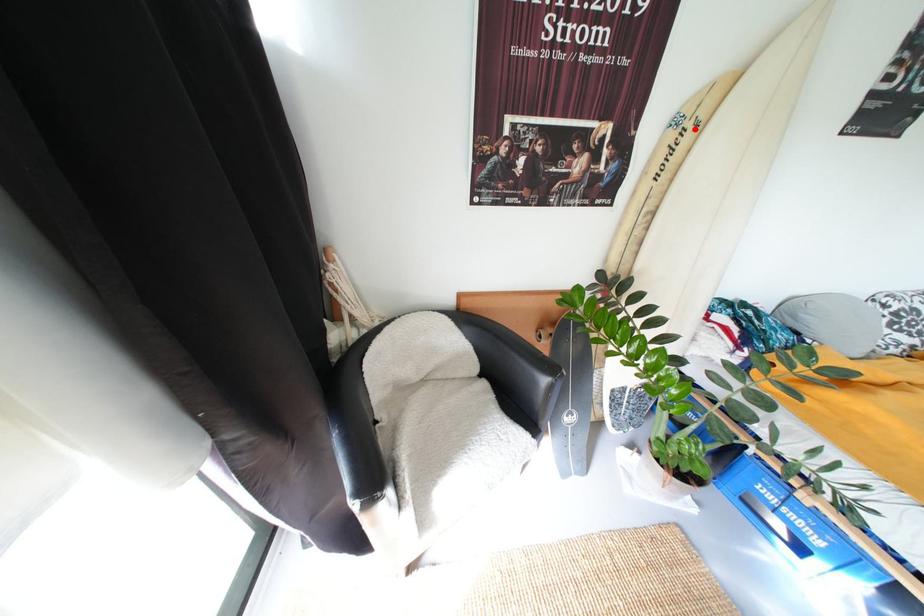
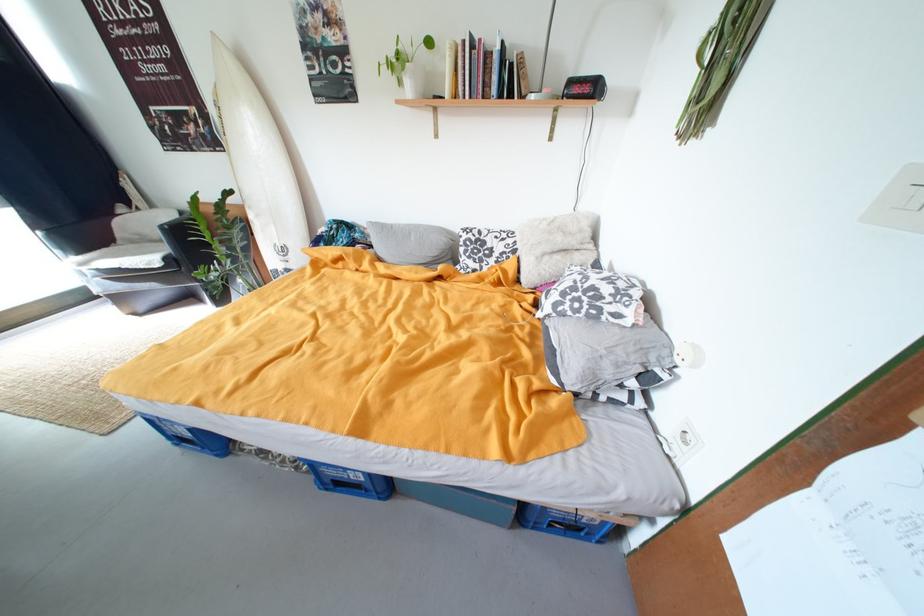
Find the pixel in the second image that matches the highlighted location in the first image.

(225, 108)